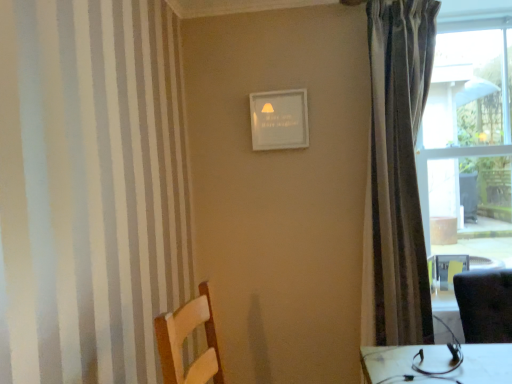
Question: Considering the relative sizes of transparent glass window at right and silky gray curtain at right in the image provided, is transparent glass window at right taller than silky gray curtain at right?

Choices:
 (A) no
 (B) yes

Answer: (A)

Question: From a real-world perspective, is transparent glass window at right positioned under silky gray curtain at right based on gravity?

Choices:
 (A) no
 (B) yes

Answer: (A)

Question: Can you confirm if transparent glass window at right is positioned to the left of silky gray curtain at right?

Choices:
 (A) yes
 (B) no

Answer: (B)

Question: From the image's perspective, is transparent glass window at right on silky gray curtain at right?

Choices:
 (A) yes
 (B) no

Answer: (A)

Question: Can you confirm if transparent glass window at right is shorter than silky gray curtain at right?

Choices:
 (A) yes
 (B) no

Answer: (A)

Question: Is transparent glass window at right next to silky gray curtain at right?

Choices:
 (A) yes
 (B) no

Answer: (B)

Question: From the image's perspective, is silky gray curtain at right on top of transparent glass window at right?

Choices:
 (A) no
 (B) yes

Answer: (A)

Question: Is silky gray curtain at right closer to camera compared to transparent glass window at right?

Choices:
 (A) no
 (B) yes

Answer: (B)

Question: Is transparent glass window at right located within silky gray curtain at right?

Choices:
 (A) no
 (B) yes

Answer: (A)

Question: Can you confirm if silky gray curtain at right is thinner than transparent glass window at right?

Choices:
 (A) no
 (B) yes

Answer: (B)

Question: Is silky gray curtain at right looking in the opposite direction of transparent glass window at right?

Choices:
 (A) no
 (B) yes

Answer: (A)

Question: From the image's perspective, would you say silky gray curtain at right is shown under transparent glass window at right?

Choices:
 (A) no
 (B) yes

Answer: (B)

Question: Is silky gray curtain at right to the left or to the right of transparent glass window at right in the image?

Choices:
 (A) right
 (B) left

Answer: (B)